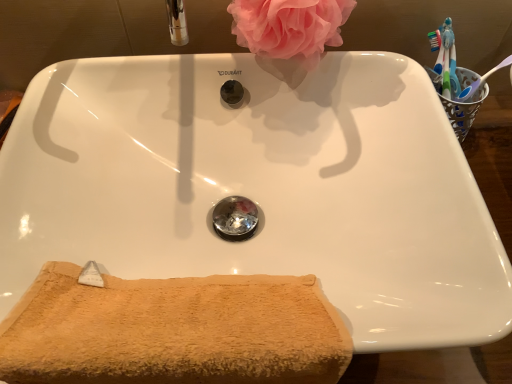
This screenshot has width=512, height=384. What do you see at coordinates (173, 331) in the screenshot? I see `beige terry cloth towel at lower left` at bounding box center [173, 331].

Identify the location of beige terry cloth towel at lower left. (173, 331).

Measure the distance between point (x=323, y=47) and camera.

Point (x=323, y=47) and camera are 57.50 centimeters apart.

What do you see at coordinates (289, 26) in the screenshot?
I see `pink fluffy sponge at upper center` at bounding box center [289, 26].

What is the approximate width of pink fluffy sponge at upper center?

5.75 inches.

Locate an element on the screen. pink fluffy sponge at upper center is located at coordinates (289, 26).

Find the location of a particular element. This screenshot has width=512, height=384. beige terry cloth towel at lower left is located at coordinates (173, 331).

Looking at this image, is beige terry cloth towel at lower left to the right of pink fluffy sponge at upper center from the viewer's perspective?

No.

Which object is more forward, beige terry cloth towel at lower left or pink fluffy sponge at upper center?

Positioned in front is beige terry cloth towel at lower left.

Considering the points (94, 296) and (308, 47), which point is behind, point (94, 296) or point (308, 47)?

The point (308, 47) is farther from the camera.

From the image's perspective, is beige terry cloth towel at lower left located above pink fluffy sponge at upper center?

No.

From a real-world perspective, is beige terry cloth towel at lower left located higher than pink fluffy sponge at upper center?

No, from a real-world perspective, beige terry cloth towel at lower left is not over pink fluffy sponge at upper center

Is beige terry cloth towel at lower left wider than pink fluffy sponge at upper center?

No, beige terry cloth towel at lower left is not wider than pink fluffy sponge at upper center.

In the scene shown: Who is shorter, beige terry cloth towel at lower left or pink fluffy sponge at upper center?

Standing shorter between the two is pink fluffy sponge at upper center.

Considering the sizes of objects beige terry cloth towel at lower left and pink fluffy sponge at upper center in the image provided, who is smaller, beige terry cloth towel at lower left or pink fluffy sponge at upper center?

pink fluffy sponge at upper center is smaller.

Would you say beige terry cloth towel at lower left is inside or outside pink fluffy sponge at upper center?

beige terry cloth towel at lower left is located beyond the bounds of pink fluffy sponge at upper center.

Is there a large distance between beige terry cloth towel at lower left and pink fluffy sponge at upper center?

No, there isn't a large distance between beige terry cloth towel at lower left and pink fluffy sponge at upper center.

Does beige terry cloth towel at lower left turn towards pink fluffy sponge at upper center?

No, beige terry cloth towel at lower left does not turn towards pink fluffy sponge at upper center.

Measure the distance between beige terry cloth towel at lower left and pink fluffy sponge at upper center.

beige terry cloth towel at lower left is 13.83 inches away from pink fluffy sponge at upper center.

Where is `rose located above the beige terry cloth towel at lower left (from a real-world perspective)`? rose located above the beige terry cloth towel at lower left (from a real-world perspective) is located at coordinates (289, 26).

Between pink fluffy sponge at upper center and beige terry cloth towel at lower left, which one appears on the left side from the viewer's perspective?

Positioned to the left is beige terry cloth towel at lower left.

Is pink fluffy sponge at upper center in front of or behind beige terry cloth towel at lower left in the image?

pink fluffy sponge at upper center is behind beige terry cloth towel at lower left.

Considering the positions of points (310, 60) and (117, 344), is point (310, 60) closer to camera compared to point (117, 344)?

That is False.

From the image's perspective, is pink fluffy sponge at upper center on top of beige terry cloth towel at lower left?

Yes, from the image's perspective, pink fluffy sponge at upper center is over beige terry cloth towel at lower left.

From a real-world perspective, is pink fluffy sponge at upper center positioned under beige terry cloth towel at lower left based on gravity?

Incorrect, from a real-world perspective, pink fluffy sponge at upper center is higher than beige terry cloth towel at lower left.

Between pink fluffy sponge at upper center and beige terry cloth towel at lower left, which one has larger width?

pink fluffy sponge at upper center.

Can you confirm if pink fluffy sponge at upper center is taller than beige terry cloth towel at lower left?

Incorrect, the height of pink fluffy sponge at upper center is not larger of that of beige terry cloth towel at lower left.

Considering the relative sizes of pink fluffy sponge at upper center and beige terry cloth towel at lower left in the image provided, is pink fluffy sponge at upper center smaller than beige terry cloth towel at lower left?

Indeed, pink fluffy sponge at upper center has a smaller size compared to beige terry cloth towel at lower left.

Is pink fluffy sponge at upper center not inside beige terry cloth towel at lower left?

pink fluffy sponge at upper center is positioned outside beige terry cloth towel at lower left.

Can you see pink fluffy sponge at upper center touching beige terry cloth towel at lower left?

pink fluffy sponge at upper center and beige terry cloth towel at lower left are clearly separated.

Consider the image. Does pink fluffy sponge at upper center turn towards beige terry cloth towel at lower left?

Yes.

How different are the orientations of pink fluffy sponge at upper center and beige terry cloth towel at lower left in degrees?

The angular difference between pink fluffy sponge at upper center and beige terry cloth towel at lower left is 0.000207 degrees.

Identify the location of bath towel located underneath the pink fluffy sponge at upper center (from a real-world perspective). (173, 331).

Where is `bath towel below the pink fluffy sponge at upper center (from the image's perspective)`? The height and width of the screenshot is (384, 512). bath towel below the pink fluffy sponge at upper center (from the image's perspective) is located at coordinates (173, 331).

Identify the location of rose located on the right of beige terry cloth towel at lower left. (289, 26).